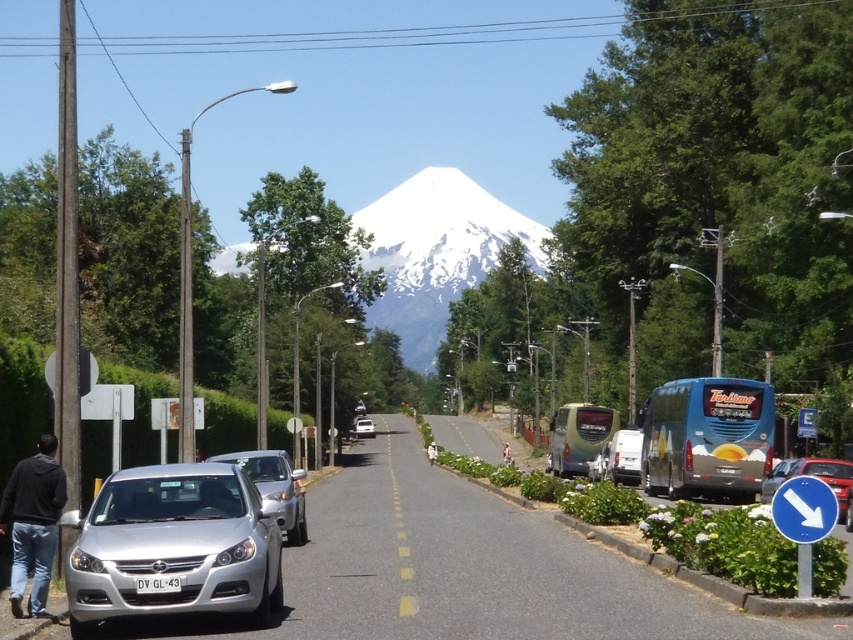
The height and width of the screenshot is (640, 853). What do you see at coordinates (33, 522) in the screenshot?
I see `black hoodie at lower left` at bounding box center [33, 522].

Can you confirm if black hoodie at lower left is smaller than white matte van at center?

Indeed, black hoodie at lower left has a smaller size compared to white matte van at center.

Which is in front, point (32, 518) or point (625, 452)?

Point (32, 518) is in front.

Find the location of a particular element. The width and height of the screenshot is (853, 640). black hoodie at lower left is located at coordinates (33, 522).

Does silver metallic car at lower left have a lesser height compared to white matte car at center?

Yes.

The width and height of the screenshot is (853, 640). What are the coordinates of `silver metallic car at lower left` in the screenshot? It's located at (173, 547).

Where is `silver metallic car at lower left`? This screenshot has width=853, height=640. silver metallic car at lower left is located at coordinates (173, 547).

Can you confirm if silver metallic car at lower left is bigger than satin silver sedan at center?

Actually, silver metallic car at lower left might be smaller than satin silver sedan at center.

Locate an element on the screen. This screenshot has height=640, width=853. silver metallic car at lower left is located at coordinates (173, 547).

Between point (126, 470) and point (254, 456), which one is positioned in front?

Point (126, 470) is in front.

Identify the location of silver metallic car at lower left. The image size is (853, 640). (173, 547).